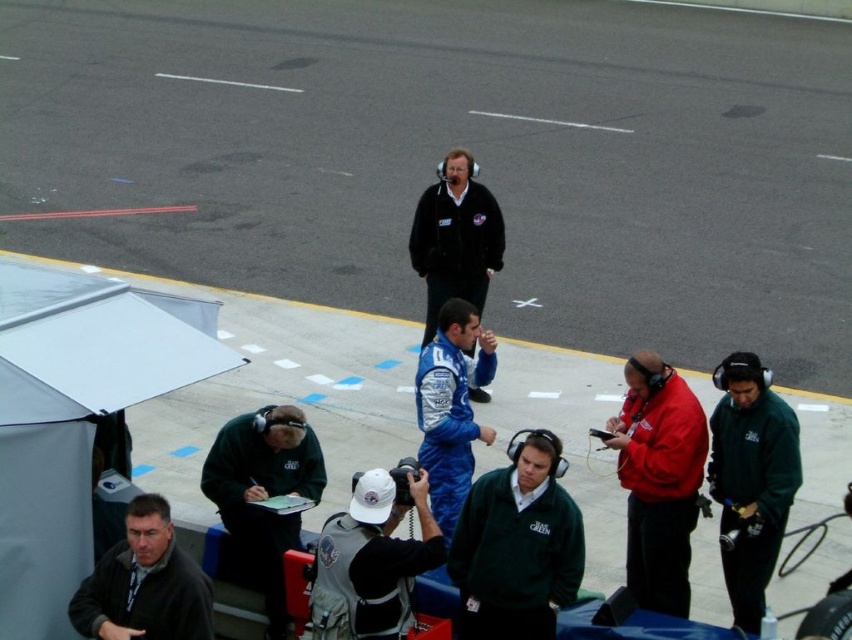
Question: Among these points, which one is farthest from the camera?

Choices:
 (A) (536, 560)
 (B) (540, 330)

Answer: (B)

Question: Is asphalt at center bigger than green fleece jacket at center-right?

Choices:
 (A) yes
 (B) no

Answer: (A)

Question: Is green fleece jacket at lower left bigger than dark gray jacket at lower left?

Choices:
 (A) yes
 (B) no

Answer: (A)

Question: Does green fleece jacket at lower left come behind blue fabric suit at center?

Choices:
 (A) yes
 (B) no

Answer: (B)

Question: Which object appears farthest from the camera in this image?

Choices:
 (A) red matte jacket at center
 (B) dark gray jacket at lower left

Answer: (A)

Question: Which object is positioned farthest from the blue fabric suit at center?

Choices:
 (A) green fleece jacket at center-right
 (B) green fleece jacket at lower left
 (C) green fleece jacket at center

Answer: (A)